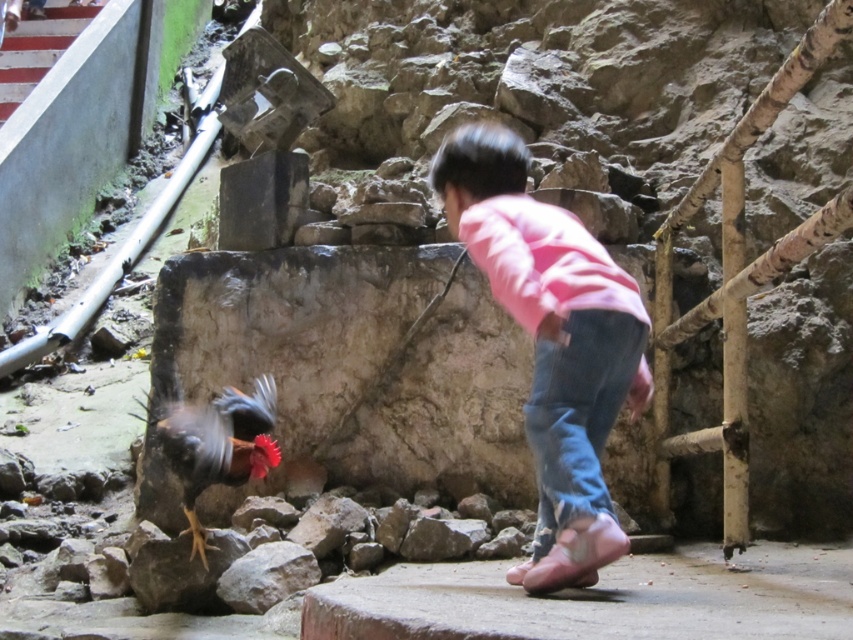
Question: Observing the image, what is the correct spatial positioning of pink cotton shirt at center in reference to blue denim jeans at lower center?

Choices:
 (A) right
 (B) left

Answer: (B)

Question: Is pink cotton shirt at center smaller than multicolored feathered rooster at center?

Choices:
 (A) no
 (B) yes

Answer: (A)

Question: Which point is closer to the camera taking this photo?

Choices:
 (A) (207, 442)
 (B) (624, 316)
 (C) (543, 468)

Answer: (B)

Question: Which object is closer to the camera taking this photo?

Choices:
 (A) pink cotton shirt at center
 (B) blue denim jeans at lower center

Answer: (A)

Question: Among these points, which one is farthest from the camera?

Choices:
 (A) (204, 442)
 (B) (610, 323)
 (C) (518, 195)

Answer: (A)

Question: Does pink cotton shirt at center have a larger size compared to blue denim jeans at lower center?

Choices:
 (A) yes
 (B) no

Answer: (A)